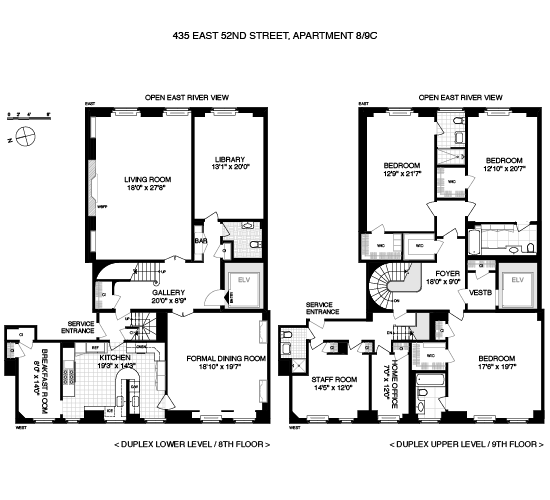
Where is `duplex lower level / 8th floor plan`? This screenshot has height=500, width=550. duplex lower level / 8th floor plan is located at coordinates (165, 310).